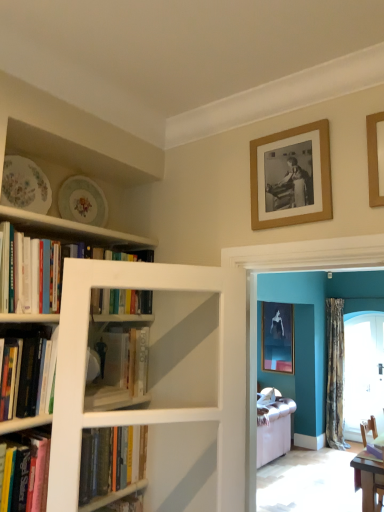
In order to click on free space above hardcover book at center, acting as the 3th book starting from the bottom (from a real-world perspective) in this screenshot , I will do `click(121, 323)`.